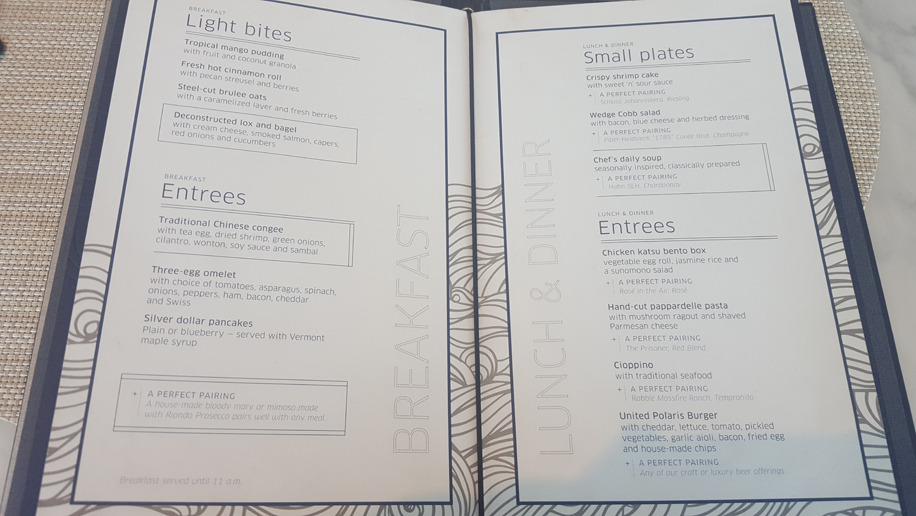
Find the location of a particular element. Image resolution: width=916 pixels, height=516 pixels. table is located at coordinates (897, 55).